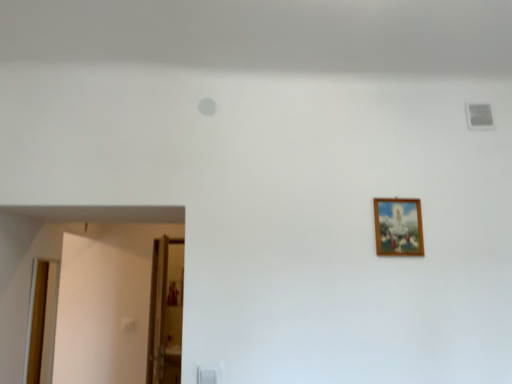
Question: Does wooden door at lower left, the second door when ordered from left to right, have a greater height compared to wooden door at left, the 1th door in the left-to-right sequence?

Choices:
 (A) yes
 (B) no

Answer: (A)

Question: From the image's perspective, would you say wooden door at lower left, the second door when ordered from left to right, is positioned over wooden door at left, the 1th door in the left-to-right sequence?

Choices:
 (A) no
 (B) yes

Answer: (B)

Question: Is wooden door at lower left, the second door when ordered from left to right, wider than wooden door at left, the 1th door in the left-to-right sequence?

Choices:
 (A) yes
 (B) no

Answer: (B)

Question: Does wooden door at lower left, the first door viewed from the right, contain wooden door at left, which is the 2th door in right-to-left order?

Choices:
 (A) no
 (B) yes

Answer: (A)

Question: Is wooden door at lower left, the first door viewed from the right, completely or partially outside of wooden door at left, which is the 2th door in right-to-left order?

Choices:
 (A) yes
 (B) no

Answer: (A)

Question: In the image, is wooden door at lower left, the first door viewed from the right, positioned in front of or behind wooden door at left, the 1th door in the left-to-right sequence?

Choices:
 (A) behind
 (B) front

Answer: (A)

Question: From a real-world perspective, relative to wooden door at left, which is the 2th door in right-to-left order, is wooden door at lower left, the first door viewed from the right, vertically above or below?

Choices:
 (A) below
 (B) above

Answer: (B)

Question: From the image's perspective, is wooden door at lower left, the second door when ordered from left to right, positioned above or below wooden door at left, which is the 2th door in right-to-left order?

Choices:
 (A) below
 (B) above

Answer: (B)

Question: Is wooden door at lower left, the first door viewed from the right, bigger or smaller than wooden door at left, the 1th door in the left-to-right sequence?

Choices:
 (A) small
 (B) big

Answer: (B)

Question: Is wooden door at left, which is the 2th door in right-to-left order, bigger or smaller than wooden frame at upper right?

Choices:
 (A) small
 (B) big

Answer: (B)

Question: From a real-world perspective, is wooden door at left, which is the 2th door in right-to-left order, positioned above or below wooden frame at upper right?

Choices:
 (A) below
 (B) above

Answer: (A)

Question: From the image's perspective, is wooden door at left, the 1th door in the left-to-right sequence, above or below wooden frame at upper right?

Choices:
 (A) above
 (B) below

Answer: (B)

Question: In the image, is wooden door at left, the 1th door in the left-to-right sequence, on the left side or the right side of wooden frame at upper right?

Choices:
 (A) right
 (B) left

Answer: (B)

Question: Looking at their shapes, would you say wooden frame at upper right is wider or thinner than wooden door at left, the 1th door in the left-to-right sequence?

Choices:
 (A) thin
 (B) wide

Answer: (A)

Question: Visually, is wooden frame at upper right positioned to the left or to the right of wooden door at left, which is the 2th door in right-to-left order?

Choices:
 (A) right
 (B) left

Answer: (A)